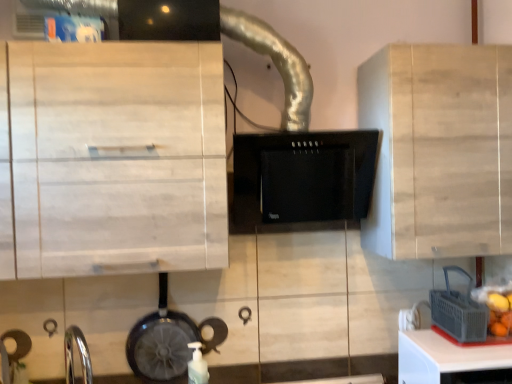
Measure the distance between point [167,315] and camera.

Point [167,315] and camera are 5.24 feet apart.

Measure the distance between point (230, 228) and camera.

Point (230, 228) and camera are 5.48 feet apart.

How much space does light wood cabinet at upper left, which ranks as the second cabinetry in right-to-left order, occupy horizontally?

light wood cabinet at upper left, which ranks as the second cabinetry in right-to-left order, is 12.63 inches wide.

I want to click on light wood cabinet at center, which is counted as the 2th cabinetry, starting from the left, so click(x=439, y=150).

Identify the location of shiny black frying pan at lower left. (161, 341).

Which is closer, (149, 330) or (435, 337)?

The point (435, 337) is closer to the camera.

Is shiny black frying pan at lower left far away from white plastic table at lower right?

No, shiny black frying pan at lower left is not far away from white plastic table at lower right.

Can you confirm if shiny black frying pan at lower left is positioned to the left of white plastic table at lower right?

Correct, you'll find shiny black frying pan at lower left to the left of white plastic table at lower right.

Considering the relative sizes of shiny black frying pan at lower left and white plastic table at lower right in the image provided, is shiny black frying pan at lower left thinner than white plastic table at lower right?

Yes, shiny black frying pan at lower left is thinner than white plastic table at lower right.

Could you tell me if light wood cabinet at upper left, which ranks as the second cabinetry in right-to-left order, is facing gray plastic basket at lower right?

No, light wood cabinet at upper left, which ranks as the second cabinetry in right-to-left order, is not aimed at gray plastic basket at lower right.

Locate an element on the screen. Image resolution: width=512 pixels, height=384 pixels. the 1st cabinetry positioned above the gray plastic basket at lower right (from a real-world perspective) is located at coordinates (112, 158).

Between light wood cabinet at upper left, placed as the first cabinetry when sorted from left to right, and gray plastic basket at lower right, which one has larger width?

light wood cabinet at upper left, placed as the first cabinetry when sorted from left to right.

In terms of height, does gray plastic basket at lower right look taller or shorter compared to light wood cabinet at upper left, which ranks as the second cabinetry in right-to-left order?

Considering their sizes, gray plastic basket at lower right has less height than light wood cabinet at upper left, which ranks as the second cabinetry in right-to-left order.

Based on the photo, which object is more forward, gray plastic basket at lower right or light wood cabinet at upper left, placed as the first cabinetry when sorted from left to right?

Positioned in front is light wood cabinet at upper left, placed as the first cabinetry when sorted from left to right.

Based on the photo, is gray plastic basket at lower right not inside light wood cabinet at upper left, placed as the first cabinetry when sorted from left to right?

Absolutely, gray plastic basket at lower right is external to light wood cabinet at upper left, placed as the first cabinetry when sorted from left to right.

From the picture: From a real-world perspective, is gray plastic basket at lower right physically below light wood cabinet at upper left, which ranks as the second cabinetry in right-to-left order?

Yes, from a real-world perspective, gray plastic basket at lower right is under light wood cabinet at upper left, which ranks as the second cabinetry in right-to-left order.

Considering the positions of points (208, 378) and (192, 326), is point (208, 378) farther from camera compared to point (192, 326)?

No, (208, 378) is closer to viewer.

How many degrees apart are the facing directions of white matte bottle at lower center and shiny black frying pan at lower left?

1.2 degrees separate the facing orientations of white matte bottle at lower center and shiny black frying pan at lower left.

Can you confirm if white matte bottle at lower center is thinner than shiny black frying pan at lower left?

No, white matte bottle at lower center is not thinner than shiny black frying pan at lower left.

Would you consider white matte bottle at lower center to be distant from shiny black frying pan at lower left?

white matte bottle at lower center is near shiny black frying pan at lower left, not far away.

Based on the photo, can you confirm if gray plastic basket at lower right is thinner than shiny black frying pan at lower left?

No, gray plastic basket at lower right is not thinner than shiny black frying pan at lower left.

From a real-world perspective, who is located lower, gray plastic basket at lower right or shiny black frying pan at lower left?

From a 3D spatial view, shiny black frying pan at lower left is below.

From the image's perspective, is gray plastic basket at lower right above shiny black frying pan at lower left?

Yes, from the image's perspective, gray plastic basket at lower right is over shiny black frying pan at lower left.

You are a GUI agent. You are given a task and a screenshot of the screen. Output one action in this format:
    pyautogui.click(x=<x>, y=<y>)
    Task: Click on the appliance that is above the shiny black frying pan at lower left (from the image's perspective)
    Image resolution: width=512 pixels, height=384 pixels.
    Given the screenshot: What is the action you would take?
    pyautogui.click(x=458, y=311)

How far apart are gray plastic basket at lower right and white plastic table at lower right?

gray plastic basket at lower right and white plastic table at lower right are 4.95 inches apart.

The height and width of the screenshot is (384, 512). I want to click on appliance behind the white plastic table at lower right, so click(x=458, y=311).

Is gray plastic basket at lower right facing away from white plastic table at lower right?

gray plastic basket at lower right does not have its back to white plastic table at lower right.

Are gray plastic basket at lower right and white plastic table at lower right far apart?

gray plastic basket at lower right is near white plastic table at lower right, not far away.

From the picture: Can you tell me how much light wood cabinet at center, which is counted as the 1th cabinetry, starting from the right, and shiny black frying pan at lower left differ in facing direction?

The facing directions of light wood cabinet at center, which is counted as the 1th cabinetry, starting from the right, and shiny black frying pan at lower left are 0.0729 degrees apart.

Which object is further away from the camera taking this photo, light wood cabinet at center, which is counted as the 2th cabinetry, starting from the left, or shiny black frying pan at lower left?

shiny black frying pan at lower left.

Which is more to the left, light wood cabinet at center, which is counted as the 1th cabinetry, starting from the right, or shiny black frying pan at lower left?

shiny black frying pan at lower left.

Looking at this image, is light wood cabinet at center, which is counted as the 2th cabinetry, starting from the left, positioned with its back to shiny black frying pan at lower left?

No, light wood cabinet at center, which is counted as the 2th cabinetry, starting from the left, is not facing the opposite direction of shiny black frying pan at lower left.

You are a GUI agent. You are given a task and a screenshot of the screen. Output one action in this format:
    pyautogui.click(x=<x>, y=<y>)
    Task: Click on the kitchen appliance that is above the white plastic table at lower right (from the image's perspective)
    
    Given the screenshot: What is the action you would take?
    pyautogui.click(x=161, y=341)

Locate an element on the screen. The image size is (512, 384). appliance located on the right of light wood cabinet at upper left, placed as the first cabinetry when sorted from left to right is located at coordinates (458, 311).

Based on their spatial positions, is light wood cabinet at center, which is counted as the 2th cabinetry, starting from the left, or black matte range hood at center closer to gray plastic basket at lower right?

light wood cabinet at center, which is counted as the 2th cabinetry, starting from the left, is positioned closer to the anchor gray plastic basket at lower right.

Which object lies further to the anchor point white plastic table at lower right, light wood cabinet at upper left, placed as the first cabinetry when sorted from left to right, or white matte bottle at lower center?

Among the two, light wood cabinet at upper left, placed as the first cabinetry when sorted from left to right, is located further to white plastic table at lower right.

Based on the photo, when comparing their distances from gray plastic basket at lower right, does light wood cabinet at center, which is counted as the 1th cabinetry, starting from the right, or white plastic table at lower right seem further?

light wood cabinet at center, which is counted as the 1th cabinetry, starting from the right, is positioned further to the anchor gray plastic basket at lower right.

Which object lies further to the anchor point black matte range hood at center, light wood cabinet at center, which is counted as the 2th cabinetry, starting from the left, or shiny black frying pan at lower left?

Among the two, shiny black frying pan at lower left is located further to black matte range hood at center.

From the image, which object appears to be nearer to gray plastic basket at lower right, shiny black frying pan at lower left or light wood cabinet at center, which is counted as the 2th cabinetry, starting from the left?

The object closer to gray plastic basket at lower right is light wood cabinet at center, which is counted as the 2th cabinetry, starting from the left.

From the image, which object appears to be nearer to white plastic table at lower right, shiny black frying pan at lower left or gray plastic basket at lower right?

gray plastic basket at lower right lies closer to white plastic table at lower right than the other object.

Consider the image. From the image, which object appears to be nearer to gray plastic basket at lower right, black matte range hood at center or white plastic table at lower right?

Among the two, white plastic table at lower right is located nearer to gray plastic basket at lower right.

Based on their spatial positions, is white plastic table at lower right or gray plastic basket at lower right further from black matte range hood at center?

Based on the image, white plastic table at lower right appears to be further to black matte range hood at center.

This screenshot has height=384, width=512. I want to click on bottle between light wood cabinet at upper left, placed as the first cabinetry when sorted from left to right, and white plastic table at lower right from left to right, so click(x=197, y=365).

The image size is (512, 384). I want to click on cabinetry between white matte bottle at lower center and gray plastic basket at lower right in the horizontal direction, so click(x=439, y=150).

The height and width of the screenshot is (384, 512). In order to click on home appliance between shiny black frying pan at lower left and light wood cabinet at center, which is counted as the 2th cabinetry, starting from the left, from left to right in this screenshot , I will do `click(302, 177)`.

The image size is (512, 384). I want to click on kitchen appliance between light wood cabinet at upper left, which ranks as the second cabinetry in right-to-left order, and black matte range hood at center from left to right, so click(x=161, y=341).